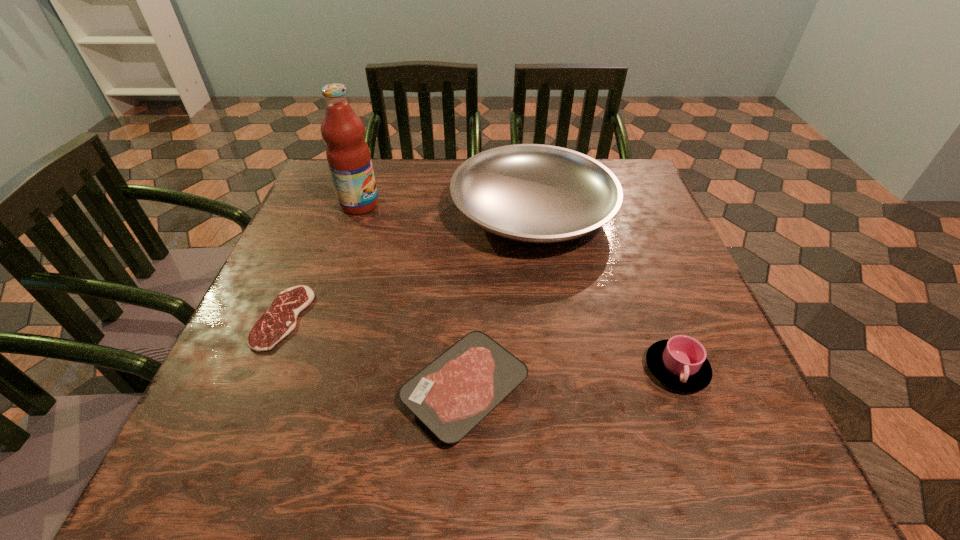
I want to click on vacant space at the near edge, so click(563, 468).

In the image, there is a desktop. Where is `blank space at the left edge`? This screenshot has height=540, width=960. blank space at the left edge is located at coordinates (294, 260).

In the image, there is a desktop. Where is `free space at the right edge`? free space at the right edge is located at coordinates (622, 259).

Locate an element on the screen. free region at the far right corner is located at coordinates (597, 160).

Locate an element on the screen. free space at the near right corner is located at coordinates (686, 480).

Where is `vacant space in between the bedpan and the taller steak`? Image resolution: width=960 pixels, height=540 pixels. vacant space in between the bedpan and the taller steak is located at coordinates (499, 301).

Identify the location of free space that is in between the left steak and the fourth tallest object. The image size is (960, 540). (374, 354).

Where is `free space that is in between the tallest object and the fourth shortest object`? This screenshot has height=540, width=960. free space that is in between the tallest object and the fourth shortest object is located at coordinates (446, 208).

This screenshot has width=960, height=540. Find the location of `free point between the bedpan and the fruit juice`. free point between the bedpan and the fruit juice is located at coordinates (446, 208).

This screenshot has width=960, height=540. In order to click on free space between the shortest object and the second shortest object in this screenshot , I will do `click(374, 354)`.